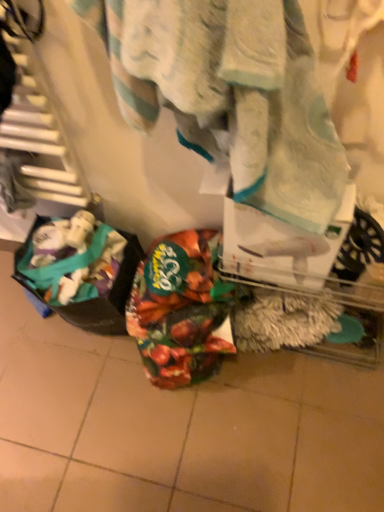
Question: From the image's perspective, is plastic bag at lower left, the 2th waste from the right, located beneath white textured towel at center?

Choices:
 (A) no
 (B) yes

Answer: (B)

Question: Is plastic bag at lower left, marked as the first waste in a left-to-right arrangement, facing away from white textured towel at center?

Choices:
 (A) yes
 (B) no

Answer: (B)

Question: Can you confirm if plastic bag at lower left, the 2th waste from the right, is taller than white textured towel at center?

Choices:
 (A) yes
 (B) no

Answer: (A)

Question: Is plastic bag at lower left, marked as the first waste in a left-to-right arrangement, closer to camera compared to white textured towel at center?

Choices:
 (A) yes
 (B) no

Answer: (B)

Question: Is plastic bag at lower left, marked as the first waste in a left-to-right arrangement, at the left side of white textured towel at center?

Choices:
 (A) yes
 (B) no

Answer: (A)

Question: Can we say plastic bag at lower left, the 2th waste from the right, lies outside white textured towel at center?

Choices:
 (A) yes
 (B) no

Answer: (A)

Question: Does plastic bag at lower left, marked as the first waste in a left-to-right arrangement, have a greater width compared to shiny metallic bag at center, the first waste viewed from the right?

Choices:
 (A) yes
 (B) no

Answer: (B)

Question: From the image's perspective, is plastic bag at lower left, the 2th waste from the right, located beneath shiny metallic bag at center, the second waste viewed from the left?

Choices:
 (A) no
 (B) yes

Answer: (A)

Question: Is plastic bag at lower left, marked as the first waste in a left-to-right arrangement, oriented away from shiny metallic bag at center, the first waste viewed from the right?

Choices:
 (A) yes
 (B) no

Answer: (B)

Question: From a real-world perspective, is plastic bag at lower left, the 2th waste from the right, physically above shiny metallic bag at center, the first waste viewed from the right?

Choices:
 (A) no
 (B) yes

Answer: (A)

Question: Are plastic bag at lower left, marked as the first waste in a left-to-right arrangement, and shiny metallic bag at center, the first waste viewed from the right, located far from each other?

Choices:
 (A) yes
 (B) no

Answer: (B)

Question: Is plastic bag at lower left, marked as the first waste in a left-to-right arrangement, facing towards shiny metallic bag at center, the second waste viewed from the left?

Choices:
 (A) no
 (B) yes

Answer: (A)

Question: From a real-world perspective, is white textured towel at center on top of plastic bag at lower left, marked as the first waste in a left-to-right arrangement?

Choices:
 (A) yes
 (B) no

Answer: (A)